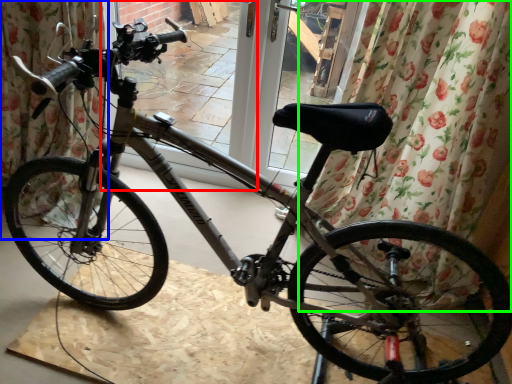
Question: Estimate the real-world distances between objects in this image. Which object is farther from screen door (highlighted by a red box), curtain (highlighted by a blue box) or curtain (highlighted by a green box)?

Choices:
 (A) curtain
 (B) curtain

Answer: (B)